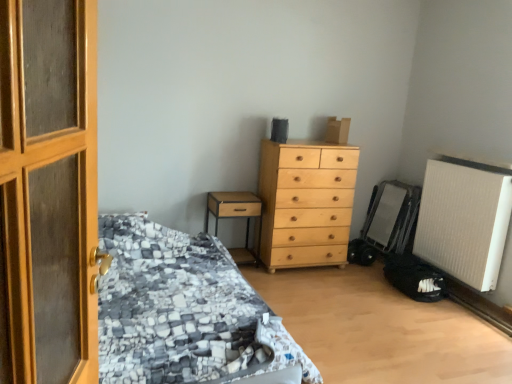
Question: Can you confirm if light wood chest of drawers at center is smaller than white textured radiator at lower right?

Choices:
 (A) yes
 (B) no

Answer: (B)

Question: Is white textured radiator at lower right surrounded by light wood chest of drawers at center?

Choices:
 (A) no
 (B) yes

Answer: (A)

Question: Does light wood chest of drawers at center turn towards white textured radiator at lower right?

Choices:
 (A) yes
 (B) no

Answer: (B)

Question: From a real-world perspective, does light wood chest of drawers at center sit lower than white textured radiator at lower right?

Choices:
 (A) no
 (B) yes

Answer: (B)

Question: From the image's perspective, would you say light wood chest of drawers at center is positioned over white textured radiator at lower right?

Choices:
 (A) yes
 (B) no

Answer: (A)

Question: Is white textured radiator at lower right in front of or behind textured gray fabric bed at left in the image?

Choices:
 (A) behind
 (B) front

Answer: (A)

Question: Is white textured radiator at lower right wider or thinner than textured gray fabric bed at left?

Choices:
 (A) thin
 (B) wide

Answer: (A)

Question: Considering the relative positions of white textured radiator at lower right and textured gray fabric bed at left in the image provided, is white textured radiator at lower right to the left or to the right of textured gray fabric bed at left?

Choices:
 (A) right
 (B) left

Answer: (A)

Question: From the image's perspective, relative to textured gray fabric bed at left, is white textured radiator at lower right above or below?

Choices:
 (A) above
 (B) below

Answer: (A)

Question: Would you say light wood chest of drawers at center is inside or outside textured gray fabric bed at left?

Choices:
 (A) inside
 (B) outside

Answer: (B)

Question: From a real-world perspective, is light wood chest of drawers at center physically located above or below textured gray fabric bed at left?

Choices:
 (A) below
 (B) above

Answer: (B)

Question: Considering their positions, is light wood chest of drawers at center located in front of or behind textured gray fabric bed at left?

Choices:
 (A) behind
 (B) front

Answer: (A)

Question: Is point (262, 188) closer or farther from the camera than point (201, 334)?

Choices:
 (A) closer
 (B) farther

Answer: (B)

Question: Considering their positions, is brown wood nightstand at left located in front of or behind light wood chest of drawers at center?

Choices:
 (A) behind
 (B) front

Answer: (A)

Question: Would you say brown wood nightstand at left is to the left or to the right of light wood chest of drawers at center in the picture?

Choices:
 (A) left
 (B) right

Answer: (A)